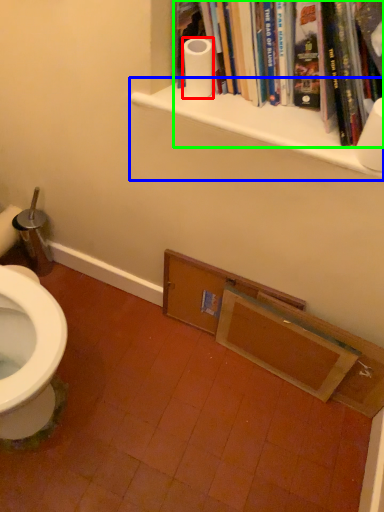
Question: Based on their relative distances, which object is nearer to toilet paper (highlighted by a red box)? Choose from shelf (highlighted by a blue box) and book (highlighted by a green box).

Choices:
 (A) shelf
 (B) book

Answer: (A)